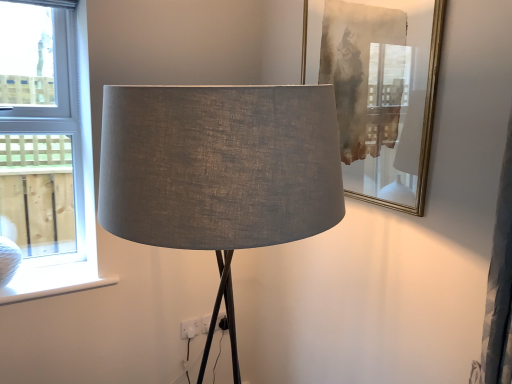
Describe the element at coordinates (190, 328) in the screenshot. The width and height of the screenshot is (512, 384). I see `white plastic electric outlet at lower center` at that location.

Find the location of a particular element. This screenshot has width=512, height=384. matte gray fabric lampshade at center is located at coordinates (219, 171).

Looking at this image, which object is further away from the camera, matte gray fabric lampshade at center or white matte window sill at lower left?

white matte window sill at lower left is behind.

From the picture: Considering the sizes of matte gray fabric lampshade at center and white matte window sill at lower left in the image, is matte gray fabric lampshade at center bigger or smaller than white matte window sill at lower left?

Considering their sizes, matte gray fabric lampshade at center takes up more space than white matte window sill at lower left.

Which point is more forward, (x=284, y=181) or (x=74, y=286)?

The point (x=284, y=181) is closer to the camera.

Considering their positions, is matte gold picture frame at upper right located in front of or behind white plastic window at left?

matte gold picture frame at upper right is in front of white plastic window at left.

Considering the relative sizes of matte gold picture frame at upper right and white plastic window at left in the image provided, is matte gold picture frame at upper right shorter than white plastic window at left?

Yes, matte gold picture frame at upper right is shorter than white plastic window at left.

Locate an element on the screen. The width and height of the screenshot is (512, 384). window lying on the left of matte gold picture frame at upper right is located at coordinates (47, 153).

Considering the relative sizes of matte gold picture frame at upper right and white plastic window at left in the image provided, is matte gold picture frame at upper right wider than white plastic window at left?

No.

Measure the distance from white plastic window at left to white matte window sill at lower left.

They are 17.24 inches apart.

Is white plastic window at left oriented towards white matte window sill at lower left?

No, white plastic window at left is not oriented towards white matte window sill at lower left.

Which of these two, white plastic window at left or white matte window sill at lower left, stands taller?

white plastic window at left is taller.

Find the location of a particular element. This screenshot has width=512, height=384. window sill located underneath the white plastic window at left (from a real-world perspective) is located at coordinates (53, 291).

Is point (24, 296) in front of point (365, 183)?

No, it is behind (365, 183).

Could matte gold picture frame at upper right be considered to be inside white matte window sill at lower left?

No, matte gold picture frame at upper right is not inside white matte window sill at lower left.

Considering the positions of objects white matte window sill at lower left and matte gold picture frame at upper right in the image provided, who is behind, white matte window sill at lower left or matte gold picture frame at upper right?

white matte window sill at lower left is further away from the camera.

Are white matte window sill at lower left and matte gold picture frame at upper right located far from each other?

Yes.

Find the location of a particular element. This screenshot has height=384, width=512. lamp located on the right of white matte window sill at lower left is located at coordinates (219, 171).

Is white matte window sill at lower left in front of or behind matte gray fabric lampshade at center in the image?

white matte window sill at lower left is positioned farther from the viewer than matte gray fabric lampshade at center.

From a real-world perspective, is white matte window sill at lower left positioned above or below matte gray fabric lampshade at center?

Clearly, from a real-world perspective, white matte window sill at lower left is below matte gray fabric lampshade at center.

Would you say white plastic electric outlet at lower center is part of matte gold picture frame at upper right's contents?

No, white plastic electric outlet at lower center is not a part of matte gold picture frame at upper right.

Can you confirm if matte gold picture frame at upper right is shorter than white plastic electric outlet at lower center?

Incorrect, the height of matte gold picture frame at upper right does not fall short of that of white plastic electric outlet at lower center.

Is matte gold picture frame at upper right aimed at white plastic electric outlet at lower center?

No, matte gold picture frame at upper right is not facing towards white plastic electric outlet at lower center.

Who is smaller, matte gold picture frame at upper right or white plastic electric outlet at lower center?

With smaller size is white plastic electric outlet at lower center.

Which of these two, white matte window sill at lower left or white plastic window at left, is thinner?

white plastic window at left is thinner.

Is the surface of white matte window sill at lower left in direct contact with white plastic window at left?

No.

Is the position of white matte window sill at lower left less distant than that of white plastic window at left?

No, the depth of white matte window sill at lower left is greater than that of white plastic window at left.

Which point is more distant from viewer, (10, 296) or (63, 17)?

The point (63, 17) is farther.

Locate an element on the screen. lamp located on the right of white matte window sill at lower left is located at coordinates (219, 171).

At what (x,y) coordinates should I click in order to perform the action: click on window below the matte gold picture frame at upper right (from the image's perspective). Please return your answer as a coordinate pair (x, y). Looking at the image, I should click on (47, 153).

From the picture: When comparing their distances from matte gold picture frame at upper right, does matte gray fabric lampshade at center or white matte window sill at lower left seem closer?

Based on the image, matte gray fabric lampshade at center appears to be nearer to matte gold picture frame at upper right.

Looking at the image, which one is located further to matte gray fabric lampshade at center, white plastic electric outlet at lower center or matte gold picture frame at upper right?

white plastic electric outlet at lower center is further to matte gray fabric lampshade at center.

From the image, which object appears to be farther from matte gold picture frame at upper right, white matte window sill at lower left or white plastic window at left?

white matte window sill at lower left is further to matte gold picture frame at upper right.

Estimate the real-world distances between objects in this image. Which object is further from white plastic window at left, white matte window sill at lower left or matte gold picture frame at upper right?

Based on the image, matte gold picture frame at upper right appears to be further to white plastic window at left.

Based on their spatial positions, is white matte window sill at lower left or matte gold picture frame at upper right further from white plastic electric outlet at lower center?

matte gold picture frame at upper right.

Which object lies further to the anchor point white plastic window at left, white matte window sill at lower left or matte gray fabric lampshade at center?

matte gray fabric lampshade at center.

Based on their spatial positions, is matte gray fabric lampshade at center or matte gold picture frame at upper right further from white plastic electric outlet at lower center?

Among the two, matte gray fabric lampshade at center is located further to white plastic electric outlet at lower center.

From the image, which object appears to be farther from white matte window sill at lower left, white plastic electric outlet at lower center or white plastic window at left?

Among the two, white plastic electric outlet at lower center is located further to white matte window sill at lower left.

At what (x,y) coordinates should I click in order to perform the action: click on window sill that lies between white plastic window at left and white plastic electric outlet at lower center from top to bottom. Please return your answer as a coordinate pair (x, y). The width and height of the screenshot is (512, 384). Looking at the image, I should click on (53, 291).

At what (x,y) coordinates should I click in order to perform the action: click on picture frame between matte gray fabric lampshade at center and white plastic electric outlet at lower center in the front-back direction. Please return your answer as a coordinate pair (x, y). Looking at the image, I should click on (379, 90).

Find the location of a particular element. The height and width of the screenshot is (384, 512). lamp between white plastic window at left and matte gold picture frame at upper right is located at coordinates (219, 171).

Where is `window positioned between matte gray fabric lampshade at center and white matte window sill at lower left from near to far`? The image size is (512, 384). window positioned between matte gray fabric lampshade at center and white matte window sill at lower left from near to far is located at coordinates (47, 153).